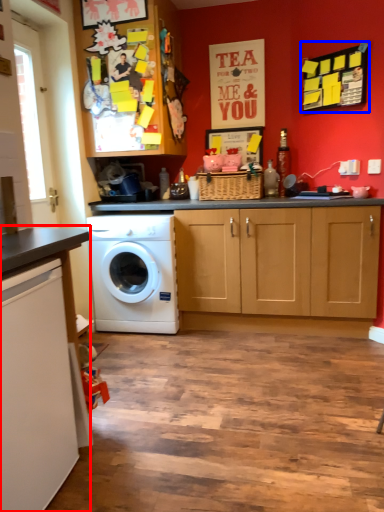
Question: Which object is further to the camera taking this photo, countertop (highlighted by a red box) or bulletin board (highlighted by a blue box)?

Choices:
 (A) countertop
 (B) bulletin board

Answer: (B)